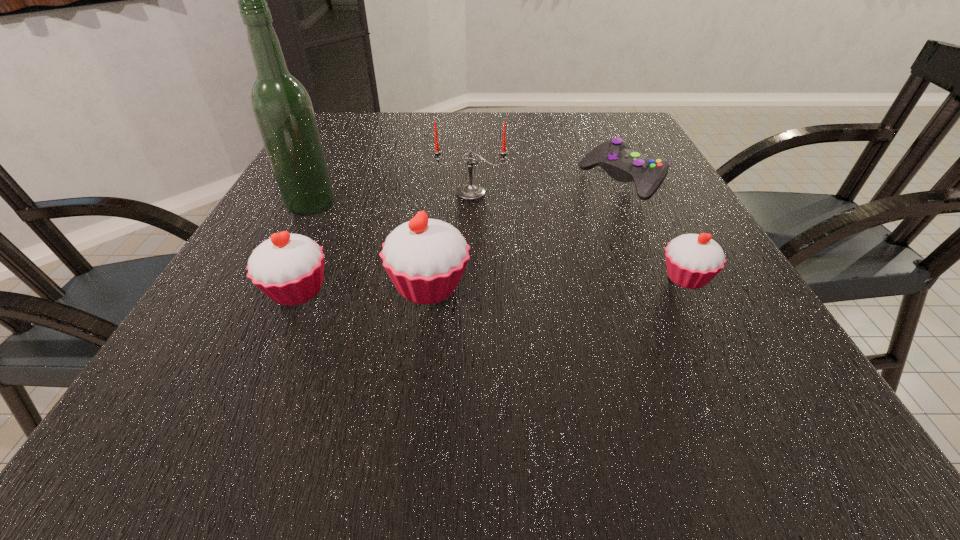
Where is `free space located on the left of the second shortest object`? This screenshot has width=960, height=540. free space located on the left of the second shortest object is located at coordinates (596, 278).

Identify the location of vacant space located 0.320m on the front-facing side of the candle. The image size is (960, 540). (468, 303).

Where is `vacant space located on the right of the liquor`? The height and width of the screenshot is (540, 960). vacant space located on the right of the liquor is located at coordinates 455,205.

The width and height of the screenshot is (960, 540). In order to click on vacant space located 0.060m on the front of the control in this screenshot , I will do `click(639, 218)`.

Where is `cupcake present at the left edge`? The width and height of the screenshot is (960, 540). cupcake present at the left edge is located at coordinates (289, 268).

In order to click on liquor that is positioned at the left edge in this screenshot , I will do `click(282, 108)`.

What are the coordinates of `cupcake that is at the right edge` in the screenshot? It's located at (692, 260).

At what (x,y) coordinates should I click in order to perform the action: click on control at the right edge. Please return your answer as a coordinate pair (x, y). Looking at the image, I should click on pyautogui.click(x=615, y=156).

Image resolution: width=960 pixels, height=540 pixels. What are the coordinates of `vacant space at the far edge` in the screenshot? It's located at (579, 120).

Locate an element on the screen. The height and width of the screenshot is (540, 960). free space at the near edge of the desktop is located at coordinates (416, 334).